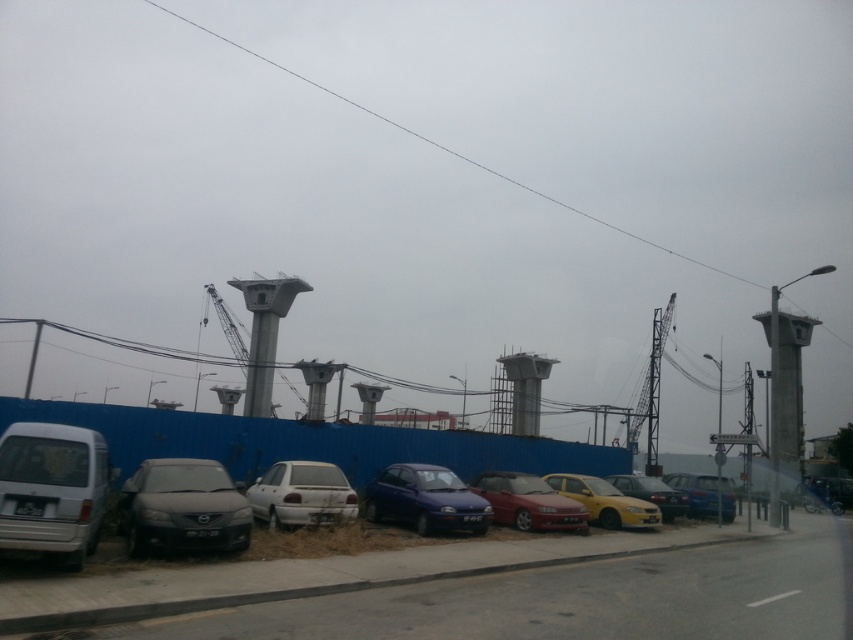
You are a delivery driver who needs to park your truck between the yellow matte car at center and the matte black sedan at center. Can your truck, which is 2 meters tall, fit in the space between them without hitting the roof?

The yellow matte car at center is not as tall as the matte black sedan at center, but since the truck is 2 meters tall, it depends on the height of the taller vehicle. However, the description does not provide specific height measurements, so it is uncertain if the truck can fit without hitting the roof.

You are a delivery driver who needs to park your truck between the matte black car at lower left and the matte black sedan at center. Your truck requires a minimum of 10 meters of space to maneuver. Can you safely park your truck in that space?

The distance between the matte black car at lower left and the matte black sedan at center is 12.63 meters, which is more than the required 10 meters. Therefore, you can safely park your truck in that space.